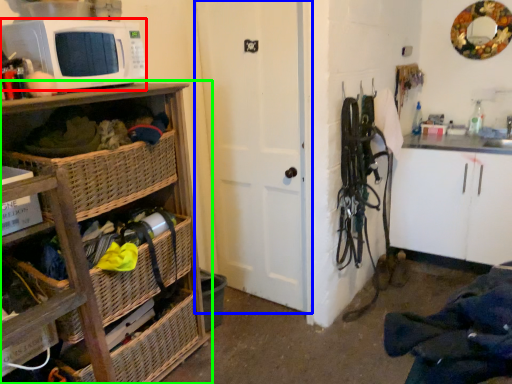
Question: Estimate the real-world distances between objects in this image. Which object is closer to microwave oven (highlighted by a red box), door (highlighted by a blue box) or cabinetry (highlighted by a green box)?

Choices:
 (A) door
 (B) cabinetry

Answer: (B)